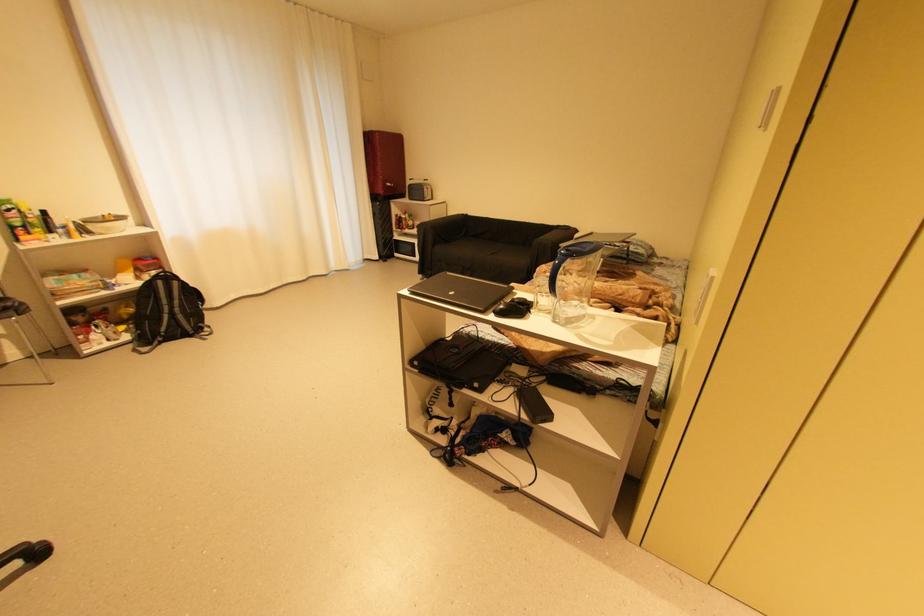
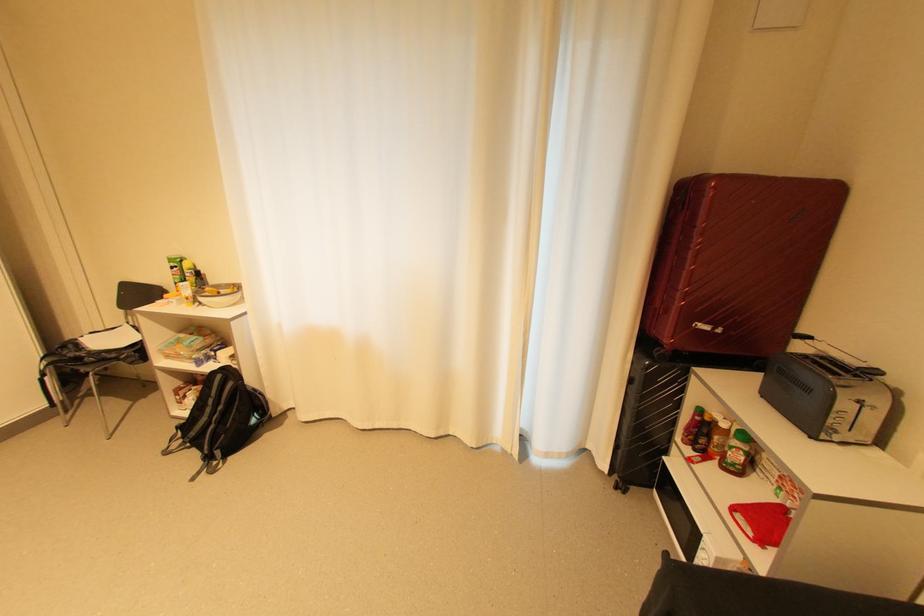
Find the pixel in the second image that matches pixel 403 229 in the first image.

(686, 439)